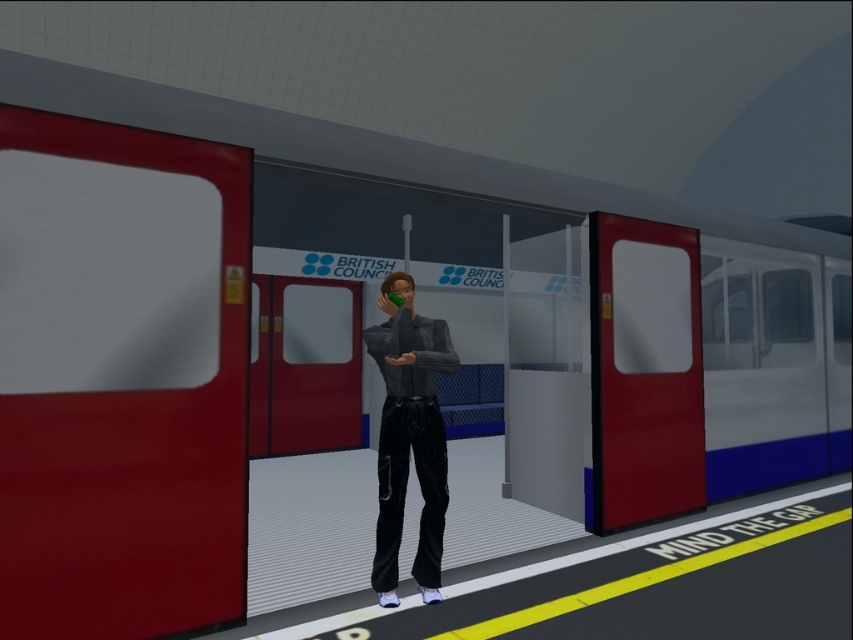
Question: Does matte red door at right have a smaller size compared to shiny black pants at center?

Choices:
 (A) yes
 (B) no

Answer: (B)

Question: Among these points, which one is nearest to the camera?

Choices:
 (A) (610, 381)
 (B) (397, 536)

Answer: (B)

Question: Is matte red door at right bigger than shiny black pants at center?

Choices:
 (A) no
 (B) yes

Answer: (B)

Question: Among these points, which one is farthest from the camera?

Choices:
 (A) (439, 481)
 (B) (675, 262)

Answer: (B)

Question: Which point is farther to the camera?

Choices:
 (A) (672, 292)
 (B) (393, 440)

Answer: (A)

Question: Can you confirm if matte red door at right is positioned to the right of shiny black pants at center?

Choices:
 (A) no
 (B) yes

Answer: (B)